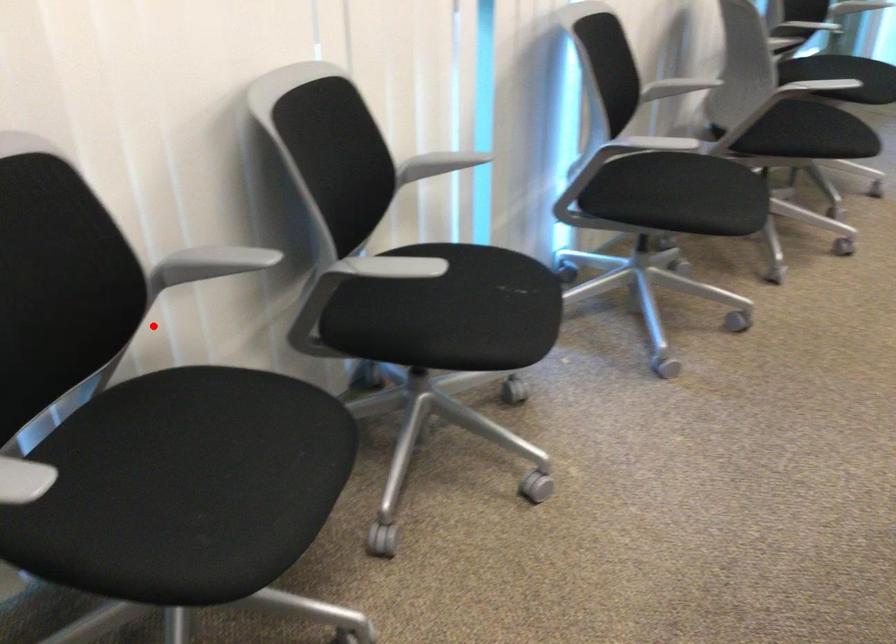
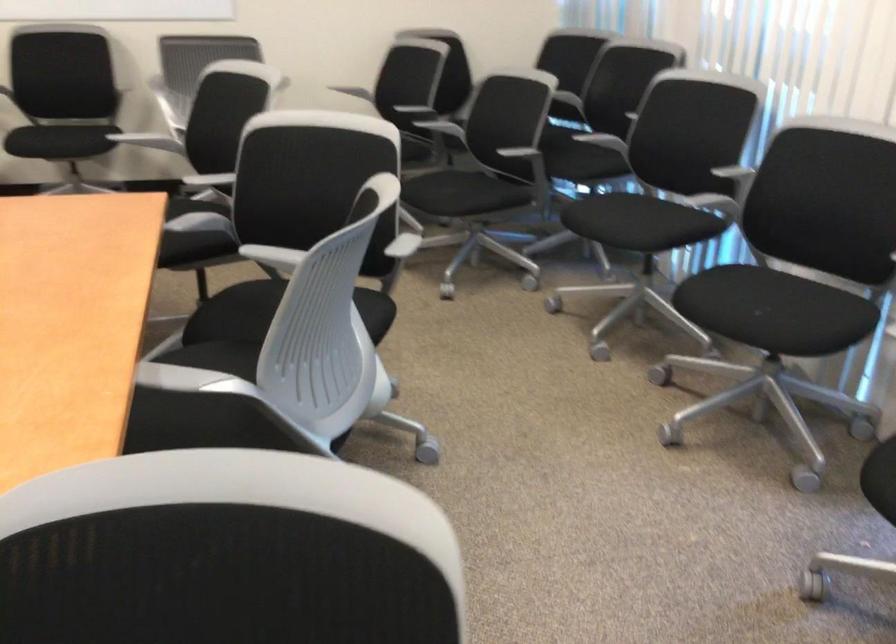
Where in the second image is the point corresponding to the highlighted location from the first image?

(726, 193)